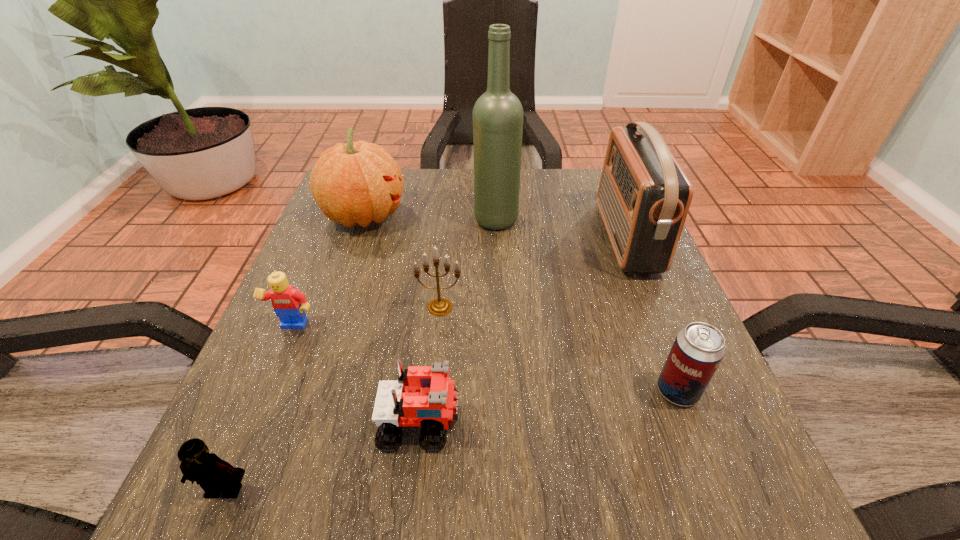
Find the location of a particular element. Image resolution: width=960 pixels, height=540 pixels. free space at the left edge of the desktop is located at coordinates (268, 348).

Locate an element on the screen. free space at the far left corner of the desktop is located at coordinates (321, 220).

The width and height of the screenshot is (960, 540). I want to click on free space at the near left corner of the desktop, so click(274, 524).

I want to click on vacant region at the far right corner, so click(x=576, y=197).

The height and width of the screenshot is (540, 960). What are the coordinates of `vacant area that lies between the wine bottle and the sixth shortest object` in the screenshot? It's located at point(430,217).

Where is `empty space between the farthest Lego and the rightmost Lego`? empty space between the farthest Lego and the rightmost Lego is located at coordinates (357, 375).

At what (x,y) coordinates should I click in order to perform the action: click on free point between the nearest object and the beer can. Please return your answer as a coordinate pair (x, y). Looking at the image, I should click on (451, 440).

Image resolution: width=960 pixels, height=540 pixels. I want to click on free space that is in between the radio receiver and the nearest object, so click(425, 363).

Locate an element on the screen. This screenshot has height=540, width=960. free space between the nearest Lego and the rightmost Lego is located at coordinates (323, 456).

Locate an element on the screen. This screenshot has height=540, width=960. vacant region between the radio receiver and the sixth object from left to right is located at coordinates (561, 228).